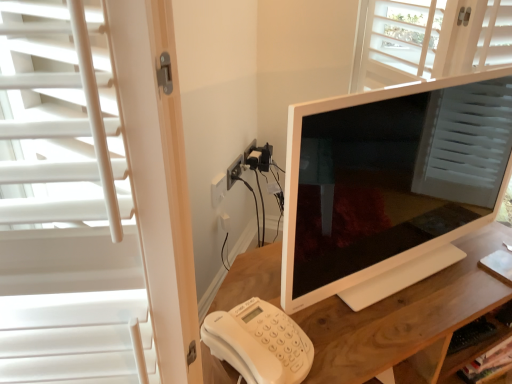
The width and height of the screenshot is (512, 384). Identify the location of wooden shelf at lower right. (474, 349).

What is the approximate width of wooden desk at center?

It is 18.39 inches.

Locate an element on the screen. This screenshot has height=384, width=512. wooden desk at center is located at coordinates (406, 319).

The height and width of the screenshot is (384, 512). What do you see at coordinates (259, 343) in the screenshot?
I see `white plastic phone at lower left` at bounding box center [259, 343].

Find the location of `white glossy monitor at center`. white glossy monitor at center is located at coordinates (391, 184).

The height and width of the screenshot is (384, 512). Describe the element at coordinates (391, 184) in the screenshot. I see `white glossy monitor at center` at that location.

I want to click on wooden shelf at lower right, so click(474, 349).

Consider the image. Are wooden desk at center and white plastic outlet at center located far from each other?

That's not correct — wooden desk at center is a little close to white plastic outlet at center.

Locate an element on the screen. The image size is (512, 384). electric outlet behind the wooden desk at center is located at coordinates (218, 190).

Is point (456, 317) more distant than point (218, 196)?

That is False.

Who is taller, wooden desk at center or white plastic outlet at center?

wooden desk at center.

Based on the photo, is white plastic phone at lower left surrounded by white glossy monitor at center?

No.

Identify the location of corded phone that appears below the white glossy monitor at center (from the image's perspective). (259, 343).

From the image's perspective, which is below, white glossy monitor at center or white plastic phone at lower left?

white plastic phone at lower left, from the image's perspective.

Which object is wider, white glossy monitor at center or white plastic phone at lower left?

white plastic phone at lower left is wider.

Is there a large distance between wooden desk at center and white glossy monitor at center?

wooden desk at center is actually quite close to white glossy monitor at center.

Can you confirm if wooden desk at center is positioned to the left of white glossy monitor at center?

Correct, you'll find wooden desk at center to the left of white glossy monitor at center.

Is point (249, 265) closer or farther from the camera than point (344, 186)?

Point (249, 265).

Is wooden desk at center turned away from white glossy monitor at center?

wooden desk at center does not have its back to white glossy monitor at center.

From a real-world perspective, is white glossy monitor at center physically below wooden shelf at lower right?

No.

Is point (300, 207) farther from viewer compared to point (447, 354)?

No, it is not.

Identify the location of television that is on the left side of wooden shelf at lower right. The image size is (512, 384). (391, 184).

From the image's perspective, who appears lower, white glossy monitor at center or wooden desk at center?

wooden desk at center appears lower in the image.

Between white glossy monitor at center and wooden desk at center, which one has less height?

With less height is wooden desk at center.

Is white glossy monitor at center with wooden desk at center?

No, white glossy monitor at center is not making contact with wooden desk at center.

Is point (409, 164) in front of point (486, 236)?

Yes, it is.

Considering the relative positions of wooden shelf at lower right and white plastic phone at lower left in the image provided, is wooden shelf at lower right to the right of white plastic phone at lower left from the viewer's perspective?

Correct, you'll find wooden shelf at lower right to the right of white plastic phone at lower left.

Which of these two, wooden shelf at lower right or white plastic phone at lower left, is thinner?

With smaller width is wooden shelf at lower right.

Locate an element on the screen. Image resolution: width=512 pixels, height=384 pixels. corded phone on the left side of wooden shelf at lower right is located at coordinates (259, 343).

Would you consider wooden shelf at lower right to be distant from white plastic phone at lower left?

They are positioned close to each other.

Which object is positioned more to the right, white plastic phone at lower left or wooden desk at center?

From the viewer's perspective, wooden desk at center appears more on the right side.

What are the coordinates of `desk below the white plastic phone at lower left (from the image's perspective)` in the screenshot? It's located at (406, 319).

Is white plastic phone at lower left not near wooden desk at center?

No.

Is point (296, 336) closer to camera compared to point (438, 284)?

Yes.

Find the location of a particular element. desk that is below the white plastic outlet at center (from the image's perspective) is located at coordinates (406, 319).

What are the coordinates of `television that is above the white plastic phone at lower left (from the image's perspective)` in the screenshot? It's located at (391, 184).

Looking at the image, which one is located closer to wooden desk at center, white plastic outlet at center or wooden shelf at lower right?

Among the two, wooden shelf at lower right is located nearer to wooden desk at center.

When comparing their distances from wooden desk at center, does white glossy monitor at center or white plastic outlet at center seem further?

white plastic outlet at center is positioned further to the anchor wooden desk at center.

Which object lies further to the anchor point wooden desk at center, white plastic phone at lower left or white glossy monitor at center?

white plastic phone at lower left is positioned further to the anchor wooden desk at center.

Considering their positions, is wooden shelf at lower right positioned closer to white plastic phone at lower left than white glossy monitor at center?

The object closer to white plastic phone at lower left is white glossy monitor at center.

Which object lies further to the anchor point white plastic phone at lower left, white plastic outlet at center or wooden shelf at lower right?

white plastic outlet at center is positioned further to the anchor white plastic phone at lower left.

Based on their spatial positions, is white plastic outlet at center or wooden desk at center further from wooden shelf at lower right?

Among the two, white plastic outlet at center is located further to wooden shelf at lower right.

Estimate the real-world distances between objects in this image. Which object is further from white glossy monitor at center, white plastic phone at lower left or wooden desk at center?

The object further to white glossy monitor at center is white plastic phone at lower left.

Considering their positions, is white glossy monitor at center positioned closer to white plastic phone at lower left than wooden shelf at lower right?

Among the two, white glossy monitor at center is located nearer to white plastic phone at lower left.

This screenshot has height=384, width=512. I want to click on television situated between white plastic outlet at center and wooden shelf at lower right from left to right, so click(x=391, y=184).

Where is `television between white plastic phone at lower left and wooden shelf at lower right from left to right`? This screenshot has height=384, width=512. television between white plastic phone at lower left and wooden shelf at lower right from left to right is located at coordinates (391, 184).

Where is `desk located between white glossy monitor at center and wooden shelf at lower right in the depth direction`? desk located between white glossy monitor at center and wooden shelf at lower right in the depth direction is located at coordinates (406, 319).

Image resolution: width=512 pixels, height=384 pixels. I want to click on corded phone between white glossy monitor at center and wooden desk at center from top to bottom, so click(x=259, y=343).